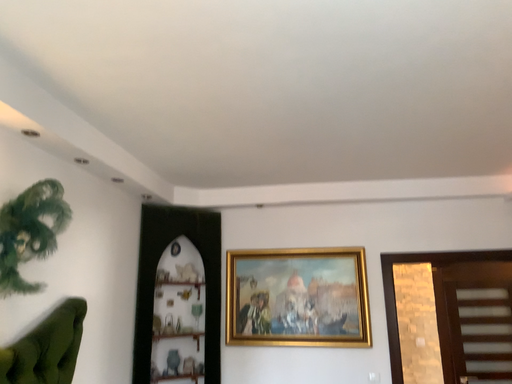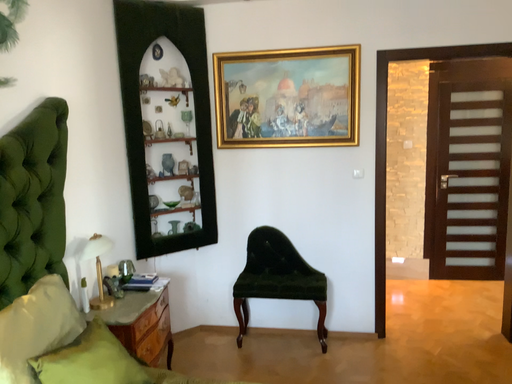
Question: How did the camera likely rotate when shooting the video?

Choices:
 (A) rotated upward
 (B) rotated downward

Answer: (B)